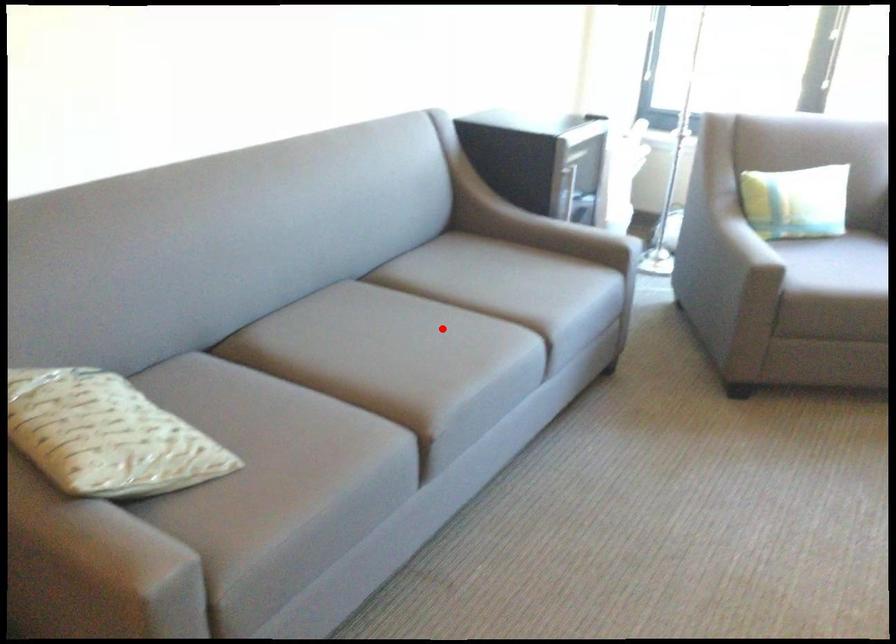
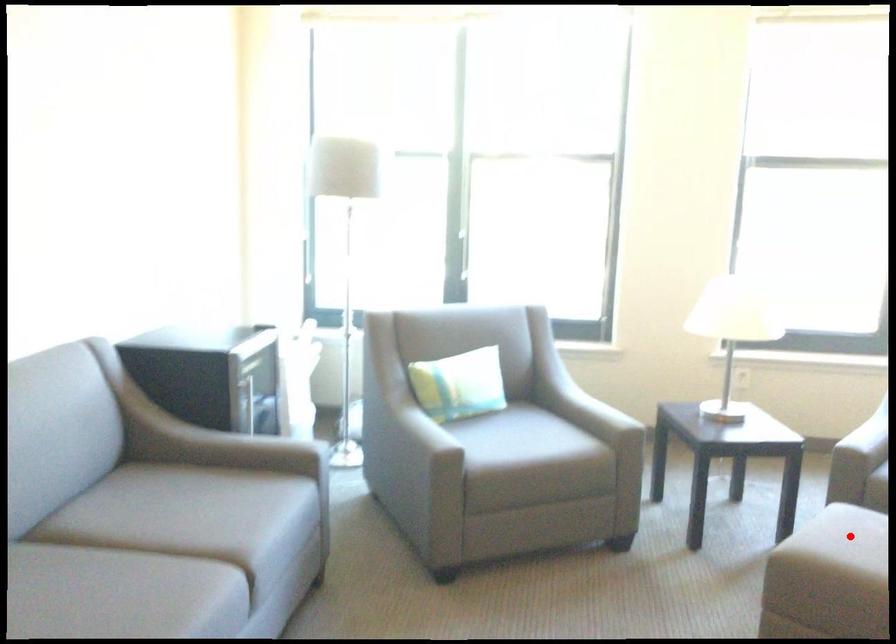
I am providing you with two images of the same scene from different viewpoints. A red point is marked on the first image and another point is marked on the second image. Is the marked point in image1 the same physical position as the marked point in image2?

No